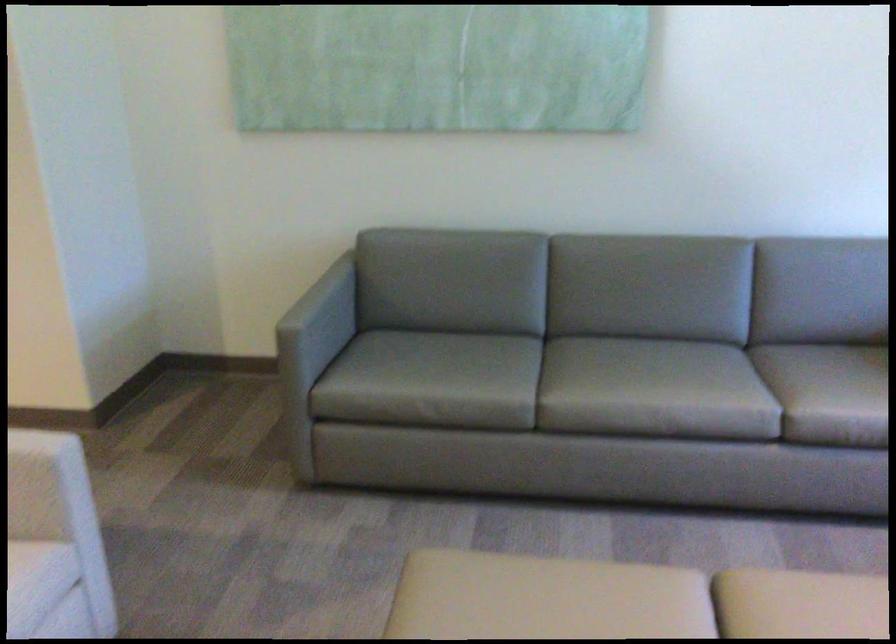
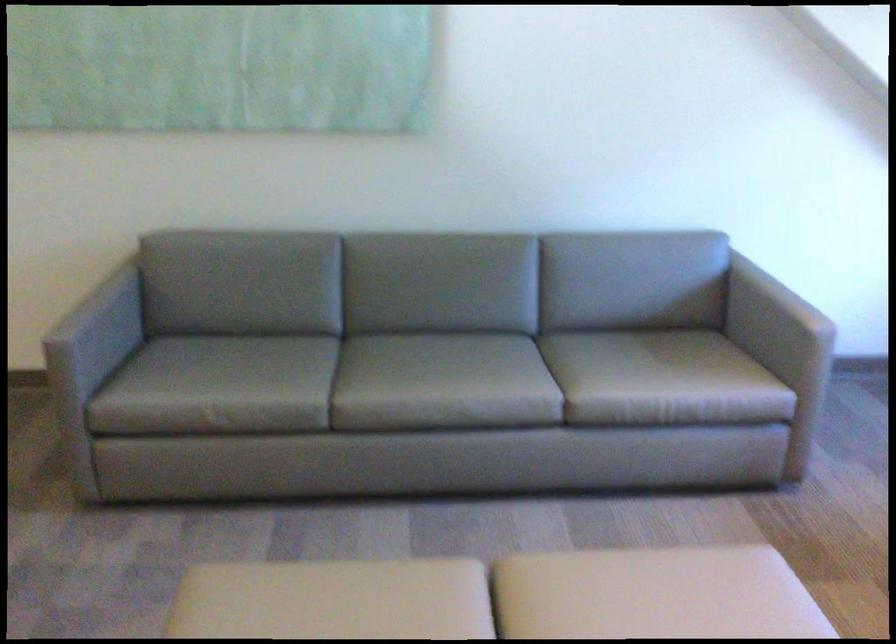
Question: The camera is either moving clockwise (left) or counter-clockwise (right) around the object. The first image is from the beginning of the video and the second image is from the end. Is the camera moving left or right when shooting the video?

Choices:
 (A) Left
 (B) Right

Answer: (A)